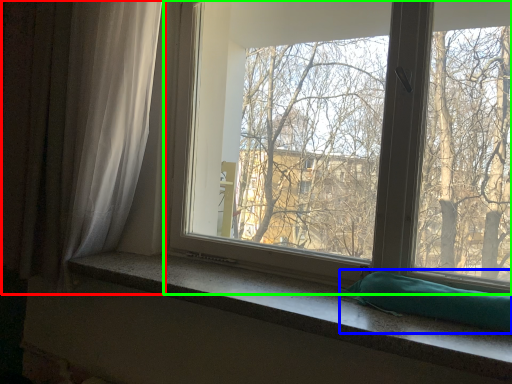
Question: Which object is positioned farthest from curtain (highlighted by a red box)? Select from pillow (highlighted by a blue box) and window (highlighted by a green box).

Choices:
 (A) pillow
 (B) window

Answer: (A)